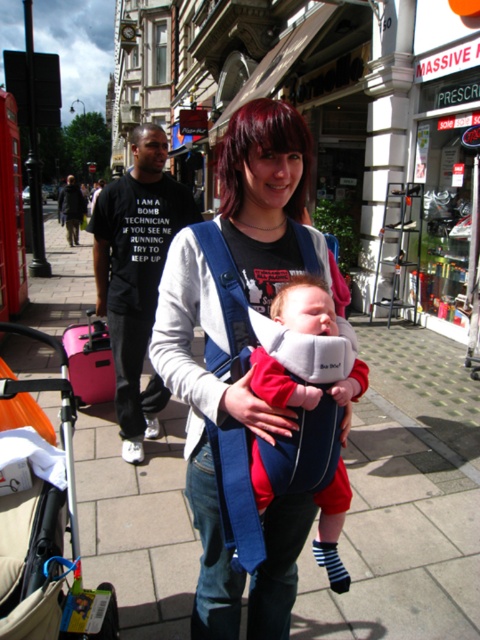
You are a photographer trying to capture the baby in the blue and white baby carrier. Since the baby is asleep, you want to ensure the carrier is visible without obscuring the baby. Based on the scene, can you confirm if the matte blue baby carrier at center is covering the soft cotton baby at center?

The matte blue baby carrier at center is positioned over soft cotton baby at center, so yes, the carrier is covering the baby.